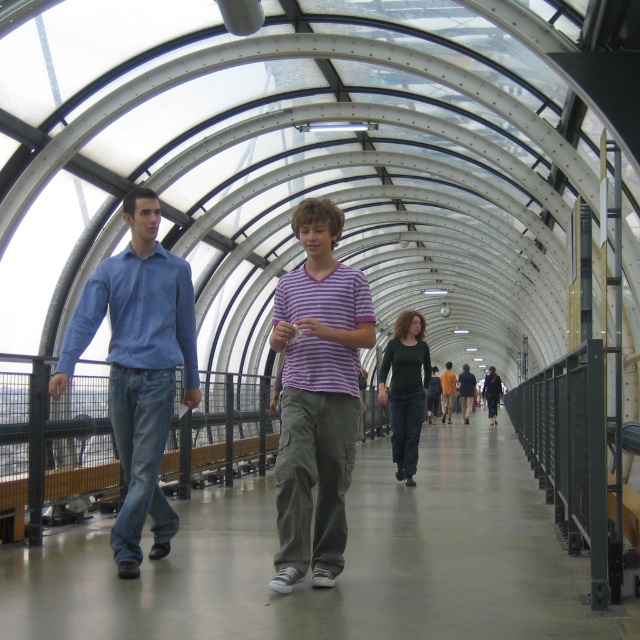
Question: Is blue cotton shirt at left to the left of dark blue shirt at center from the viewer's perspective?

Choices:
 (A) yes
 (B) no

Answer: (A)

Question: Based on their relative distances, which object is nearer to the khaki cargo pants at center?

Choices:
 (A) purple striped t-shirt at center
 (B) purple striped shirt at center

Answer: (B)

Question: Is khaki cargo pants at center wider than purple striped t-shirt at center?

Choices:
 (A) yes
 (B) no

Answer: (A)

Question: Which is farther from the purple striped shirt at center?

Choices:
 (A) dark blue jeans at center
 (B) dark green sweater at center
 (C) blue cotton shirt at left

Answer: (A)

Question: Among these objects, which one is farthest from the camera?

Choices:
 (A) blue cotton shirt at left
 (B) matte blue shirt at left

Answer: (B)

Question: Is blue cotton shirt at left positioned behind dark blue shirt at center?

Choices:
 (A) no
 (B) yes

Answer: (A)